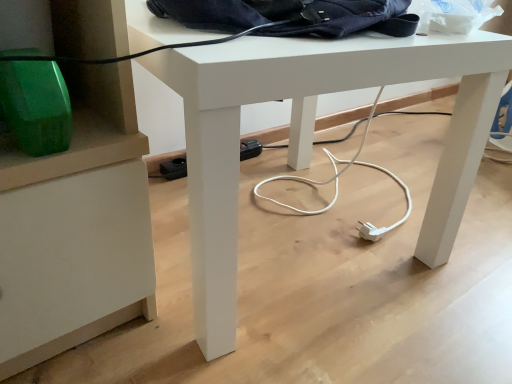
Question: From the image's perspective, is navy blue fabric messenger bag at upper center located above or below white matte desk at center?

Choices:
 (A) below
 (B) above

Answer: (B)

Question: Is point (245, 18) closer or farther from the camera than point (416, 241)?

Choices:
 (A) closer
 (B) farther

Answer: (A)

Question: In the image, is navy blue fabric messenger bag at upper center positioned in front of or behind white matte desk at center?

Choices:
 (A) behind
 (B) front

Answer: (A)

Question: In terms of width, does white matte desk at center look wider or thinner when compared to navy blue fabric messenger bag at upper center?

Choices:
 (A) wide
 (B) thin

Answer: (A)

Question: From a real-world perspective, is white matte desk at center above or below navy blue fabric messenger bag at upper center?

Choices:
 (A) above
 (B) below

Answer: (B)

Question: Is white matte desk at center to the left or to the right of navy blue fabric messenger bag at upper center in the image?

Choices:
 (A) left
 (B) right

Answer: (A)

Question: From the image's perspective, relative to navy blue fabric messenger bag at upper center, is white matte desk at center above or below?

Choices:
 (A) below
 (B) above

Answer: (A)